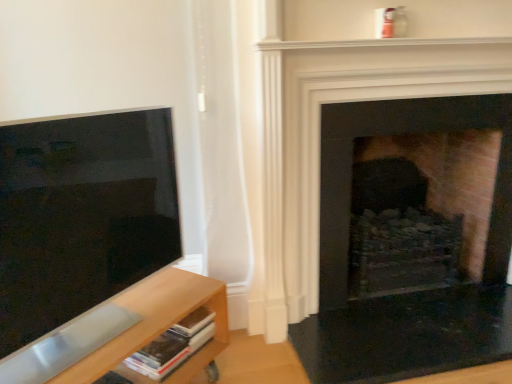
Question: Does brick fireplace at right, the 2th fireplace viewed from the front, have a smaller size compared to brick fireplace at center, placed as the 1th fireplace when sorted from front to back?

Choices:
 (A) yes
 (B) no

Answer: (B)

Question: Is brick fireplace at right, the 2th fireplace viewed from the front, placed right next to brick fireplace at center, placed as the 1th fireplace when sorted from front to back?

Choices:
 (A) yes
 (B) no

Answer: (B)

Question: Is brick fireplace at right, positioned as the 1th fireplace in back-to-front order, wider than brick fireplace at center, placed as the 1th fireplace when sorted from front to back?

Choices:
 (A) no
 (B) yes

Answer: (B)

Question: From the image's perspective, does brick fireplace at right, positioned as the 1th fireplace in back-to-front order, appear lower than brick fireplace at center, placed as the 1th fireplace when sorted from front to back?

Choices:
 (A) no
 (B) yes

Answer: (B)

Question: Is brick fireplace at right, the 2th fireplace viewed from the front, to the left of brick fireplace at center, marked as the 2th fireplace in a back-to-front arrangement, from the viewer's perspective?

Choices:
 (A) yes
 (B) no

Answer: (B)

Question: Considering the positions of brick fireplace at right, positioned as the 1th fireplace in back-to-front order, and matte black screen at left in the image, is brick fireplace at right, positioned as the 1th fireplace in back-to-front order, taller or shorter than matte black screen at left?

Choices:
 (A) short
 (B) tall

Answer: (B)

Question: Which is correct: brick fireplace at right, the 2th fireplace viewed from the front, is inside matte black screen at left, or outside of it?

Choices:
 (A) outside
 (B) inside

Answer: (A)

Question: Based on their sizes in the image, would you say brick fireplace at right, positioned as the 1th fireplace in back-to-front order, is bigger or smaller than matte black screen at left?

Choices:
 (A) small
 (B) big

Answer: (B)

Question: Visually, is brick fireplace at right, positioned as the 1th fireplace in back-to-front order, positioned to the left or to the right of matte black screen at left?

Choices:
 (A) left
 (B) right

Answer: (B)

Question: Looking at the image, does light wood shelf at lower left seem bigger or smaller compared to brick fireplace at right, the 2th fireplace viewed from the front?

Choices:
 (A) big
 (B) small

Answer: (B)

Question: Is light wood shelf at lower left inside or outside of brick fireplace at right, positioned as the 1th fireplace in back-to-front order?

Choices:
 (A) outside
 (B) inside

Answer: (A)

Question: Considering the positions of light wood shelf at lower left and brick fireplace at right, the 2th fireplace viewed from the front, in the image, is light wood shelf at lower left taller or shorter than brick fireplace at right, the 2th fireplace viewed from the front,?

Choices:
 (A) short
 (B) tall

Answer: (A)

Question: In the image, is light wood shelf at lower left on the left side or the right side of brick fireplace at right, positioned as the 1th fireplace in back-to-front order?

Choices:
 (A) right
 (B) left

Answer: (B)

Question: From their relative heights in the image, would you say brick fireplace at center, marked as the 2th fireplace in a back-to-front arrangement, is taller or shorter than brick fireplace at right, positioned as the 1th fireplace in back-to-front order?

Choices:
 (A) tall
 (B) short

Answer: (A)

Question: Is point 281,216 closer or farther from the camera than point 337,130?

Choices:
 (A) closer
 (B) farther

Answer: (A)